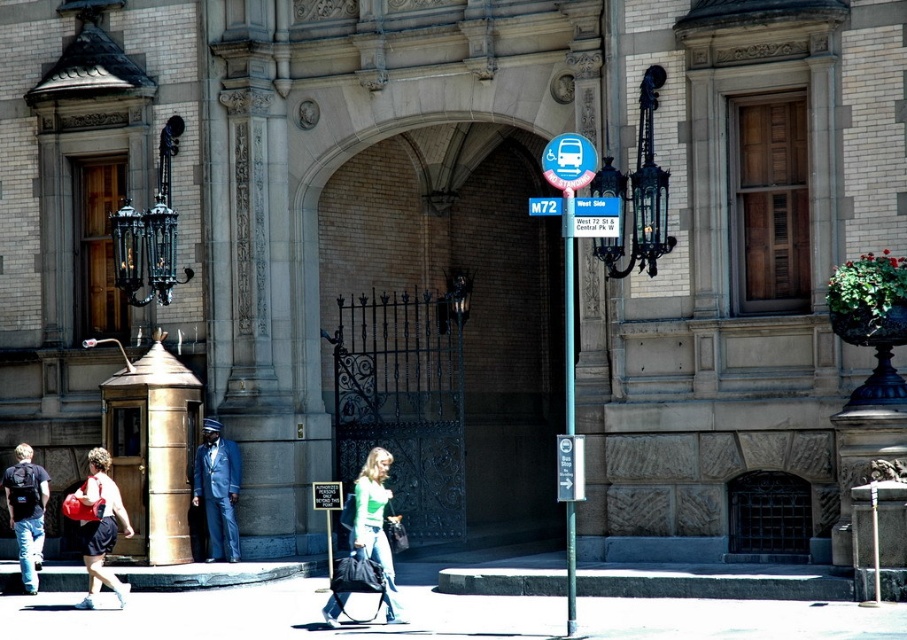
You are a pedestrian trying to reach the bus stop sign located at the corner. You see a dark blue backpack at lower left and a metallic pole at center. Which object should you move around to get to the bus stop sign?

The dark blue backpack at lower left is positioned on the left side of metallic pole at center. To reach the bus stop sign at the corner, you should move around the metallic pole at center since it is closer to your path towards the sign.

Looking at this image, you are a delivery person who needs to place a package on the ground. You see a dark blue backpack at lower left and a metallic pole at center. Which object has a smaller width, allowing you to place the package next to it without blocking the pole?

The dark blue backpack at lower left has a lesser width compared to the metallic pole at center, so you can place the package next to the dark blue backpack at lower left without blocking the pole.